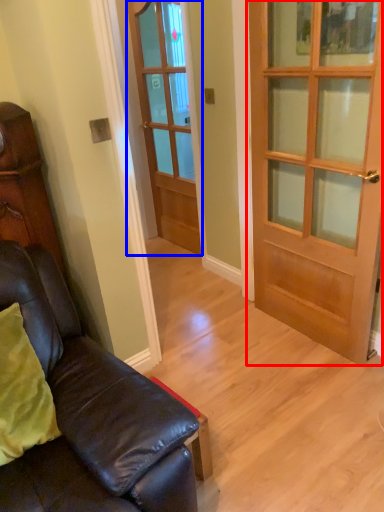
Question: Which point is further to the camera, door (highlighted by a red box) or door (highlighted by a blue box)?

Choices:
 (A) door
 (B) door

Answer: (B)